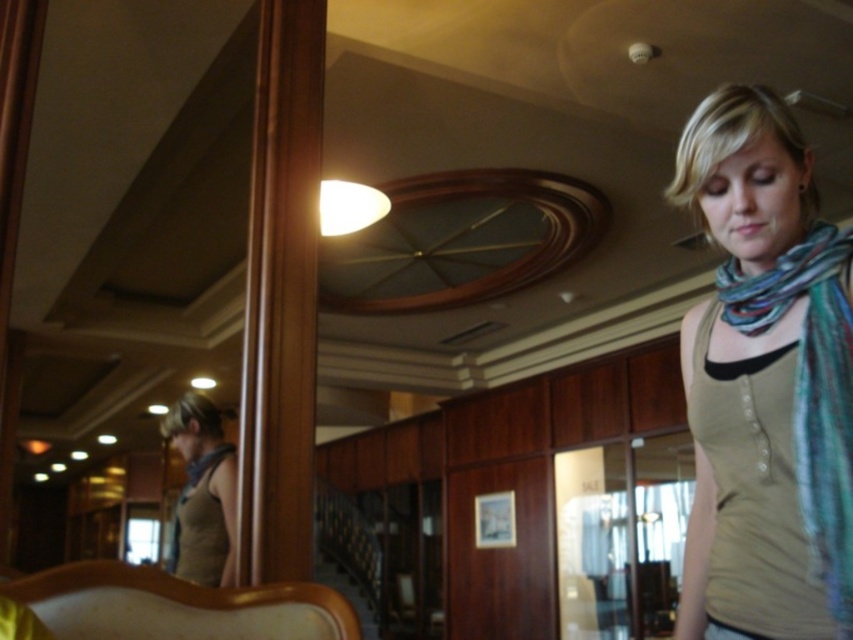
Question: Which point is farther to the camera?

Choices:
 (A) (846, 317)
 (B) (231, 556)

Answer: (B)

Question: Observing the image, what is the correct spatial positioning of multicolored woven scarf at right in reference to matte brown scarf at left?

Choices:
 (A) below
 (B) above

Answer: (B)

Question: Is multicolored woven scarf at right behind matte brown scarf at left?

Choices:
 (A) no
 (B) yes

Answer: (A)

Question: Is multicolored woven scarf at right above matte brown scarf at left?

Choices:
 (A) no
 (B) yes

Answer: (B)